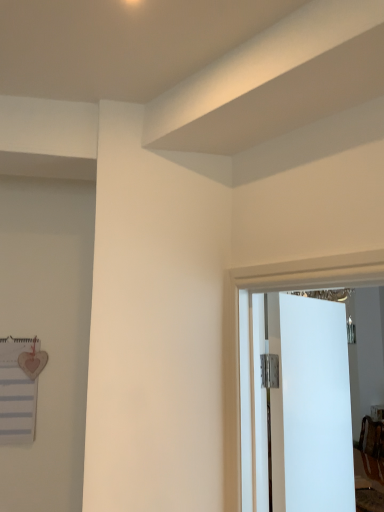
Question: Is the position of white glossy door at center more distant than that of white paperboard at left?

Choices:
 (A) yes
 (B) no

Answer: (B)

Question: Is white glossy door at center turned away from white paperboard at left?

Choices:
 (A) yes
 (B) no

Answer: (A)

Question: Is white glossy door at center positioned far away from white paperboard at left?

Choices:
 (A) no
 (B) yes

Answer: (A)

Question: Considering the relative sizes of white glossy door at center and white paperboard at left in the image provided, is white glossy door at center bigger than white paperboard at left?

Choices:
 (A) yes
 (B) no

Answer: (A)

Question: Does white glossy door at center lie in front of white paperboard at left?

Choices:
 (A) yes
 (B) no

Answer: (A)

Question: Is white glossy door at center shorter than white paperboard at left?

Choices:
 (A) no
 (B) yes

Answer: (A)

Question: Is white glossy door at center inside white paperboard at left?

Choices:
 (A) no
 (B) yes

Answer: (A)

Question: Is white paperboard at left positioned beyond the bounds of white glossy door at center?

Choices:
 (A) yes
 (B) no

Answer: (A)

Question: Is white glossy door at center at the back of white paperboard at left?

Choices:
 (A) no
 (B) yes

Answer: (A)

Question: Considering the relative sizes of white paperboard at left and white glossy door at center in the image provided, is white paperboard at left taller than white glossy door at center?

Choices:
 (A) no
 (B) yes

Answer: (A)

Question: Does white paperboard at left appear on the right side of white glossy door at center?

Choices:
 (A) no
 (B) yes

Answer: (A)

Question: From the image's perspective, is white paperboard at left over white glossy door at center?

Choices:
 (A) no
 (B) yes

Answer: (B)

Question: Considering the positions of white glossy door at center and white paperboard at left in the image, is white glossy door at center bigger or smaller than white paperboard at left?

Choices:
 (A) big
 (B) small

Answer: (A)